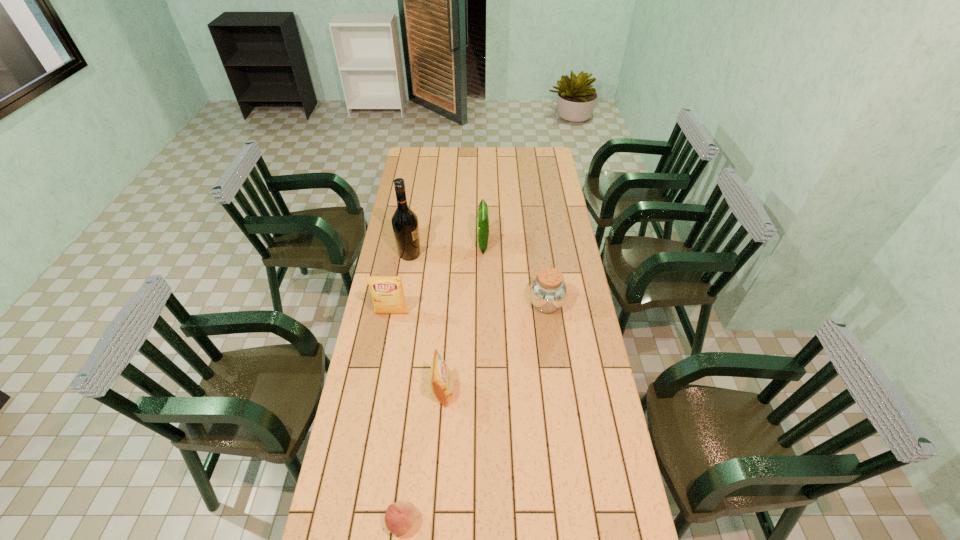
Find the location of a particular element. The height and width of the screenshot is (540, 960). wine bottle is located at coordinates 405,225.

You are a GUI agent. You are given a task and a screenshot of the screen. Output one action in this format:
    pyautogui.click(x=<x>, y=<y>)
    Task: Click on the second nearest crisp (potato chip)
    
    Given the screenshot: What is the action you would take?
    (387, 292)

At what (x,y) coordinates should I click in order to perform the action: click on the rightmost crisp (potato chip). Please return your answer as a coordinate pair (x, y). Looking at the image, I should click on (483, 224).

At what (x,y) coordinates should I click in order to perform the action: click on the fifth object from left to right. Please return your answer as a coordinate pair (x, y). Looking at the image, I should click on (483, 224).

Identify the location of the shortest crisp (potato chip). (441, 379).

Find the location of a particular element. the fifth farthest object is located at coordinates (441, 379).

The image size is (960, 540). I want to click on the rightmost object, so click(548, 292).

The image size is (960, 540). I want to click on the nearest object, so click(399, 518).

Identify the location of the shortest object. The width and height of the screenshot is (960, 540). (399, 518).

Identify the location of free location located 0.320m on the label of the tallest object. Image resolution: width=960 pixels, height=540 pixels. (492, 254).